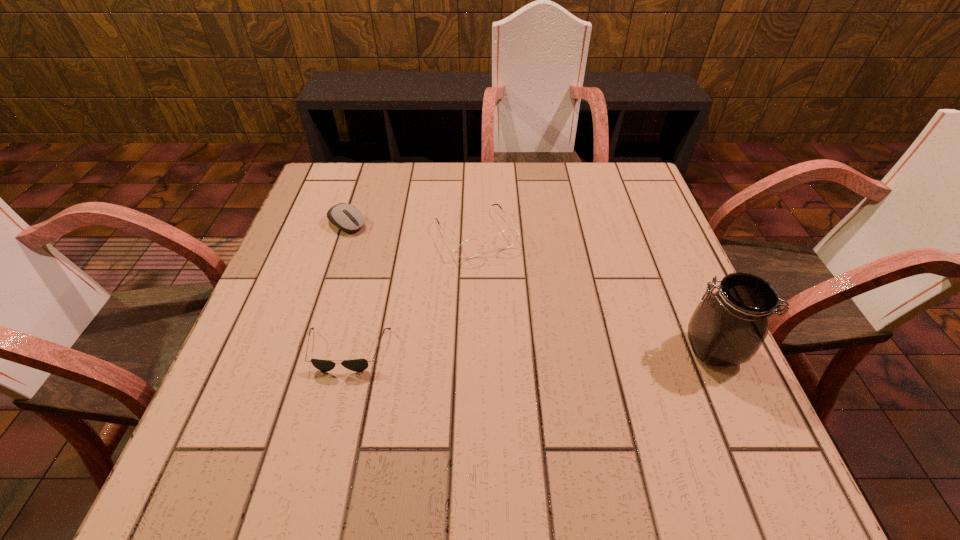
At what (x,y) coordinates should I click in order to perform the action: click on vacant region between the sunglasses and the jar. Please return your answer as a coordinate pair (x, y). The image size is (960, 540). Looking at the image, I should click on (530, 350).

Where is `free space between the sunglasses and the spectacles`? This screenshot has height=540, width=960. free space between the sunglasses and the spectacles is located at coordinates (412, 292).

The width and height of the screenshot is (960, 540). I want to click on free space between the computer equipment and the tallest object, so [x=530, y=286].

The image size is (960, 540). I want to click on vacant region between the sunglasses and the computer equipment, so click(348, 287).

The width and height of the screenshot is (960, 540). I want to click on empty space between the second tallest object and the tallest object, so click(594, 291).

Image resolution: width=960 pixels, height=540 pixels. What are the coordinates of `vacant space that's between the computer equipment and the sunglasses` in the screenshot? It's located at (348, 287).

The width and height of the screenshot is (960, 540). Identify the location of blank region between the second object from right to left and the sunglasses. (412, 292).

The image size is (960, 540). Identify the location of object that is the third closest to the computer equipment. (728, 327).

Choose which object is the second nearest neighbor to the sunglasses. Please provide its 2D coordinates. Your answer should be formatted as a tuple, i.e. [(x, y)], where the tuple contains the x and y coordinates of a point satisfying the conditions above.

[(348, 218)]

What are the coordinates of `vacant area that satisfies the following two spatial constraints: 1. on the front side of the computer equipment; 2. on the lid of the jar` in the screenshot? It's located at (305, 349).